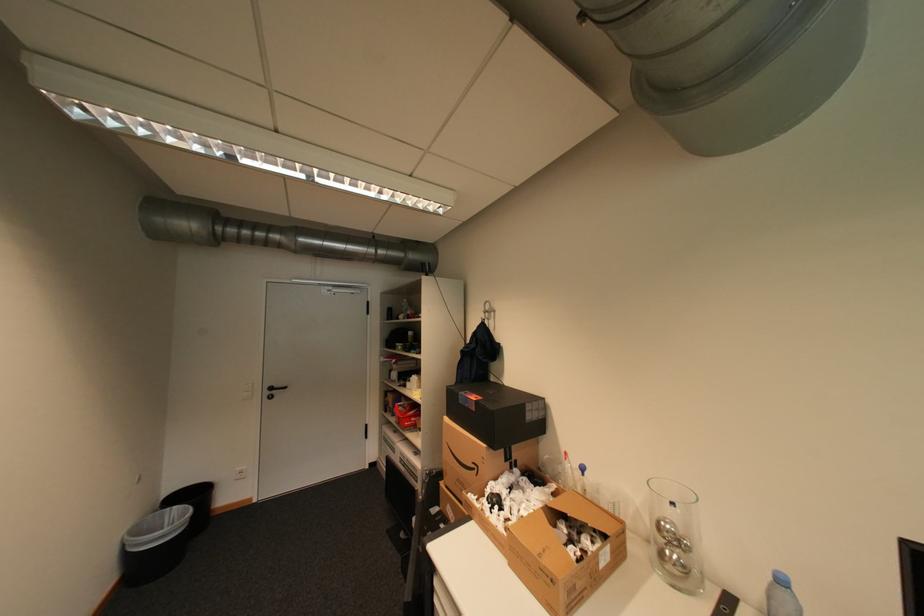
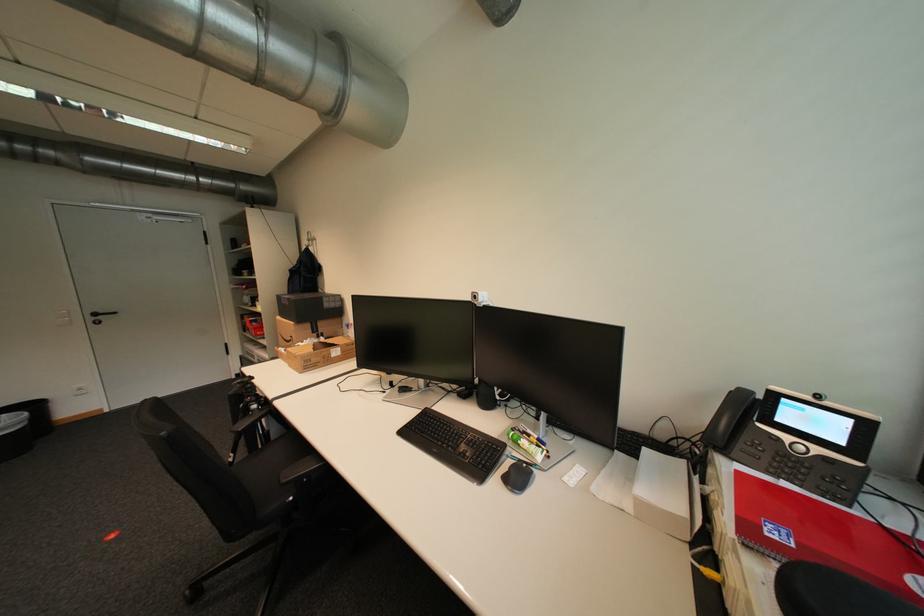
Where in the second image is the point corresponding to pixel 481 464 from the first image?

(299, 338)